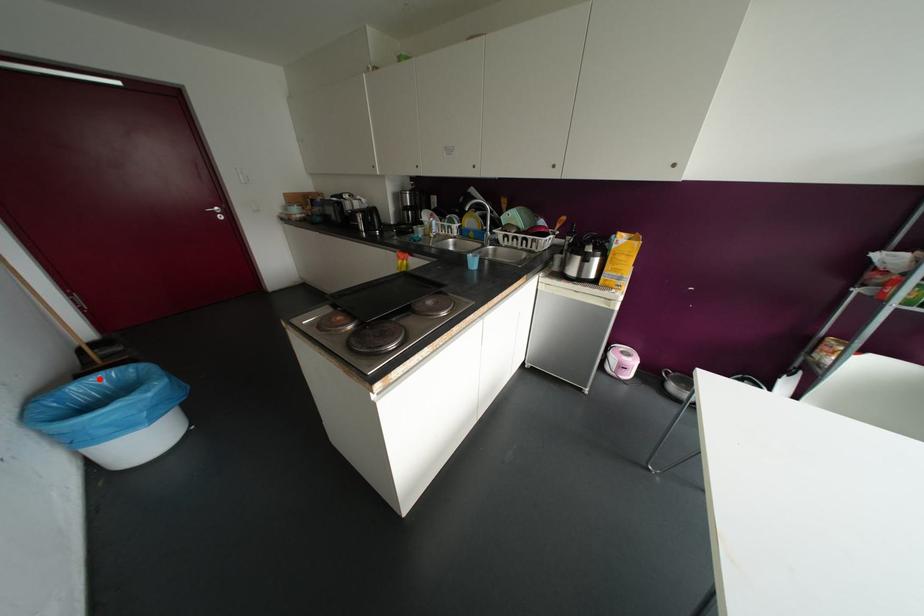
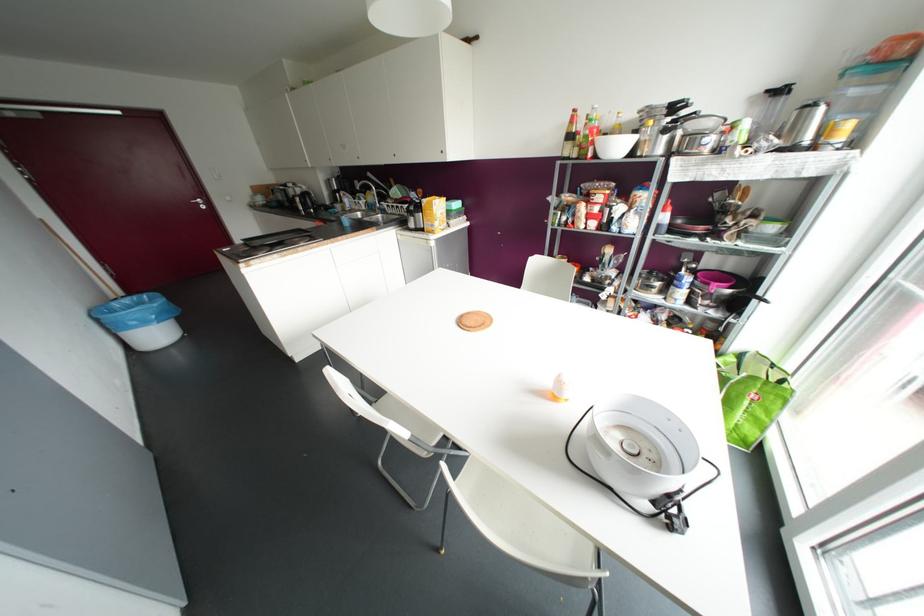
Find the pixel in the second image that matches the highlighted location in the first image.

(127, 300)